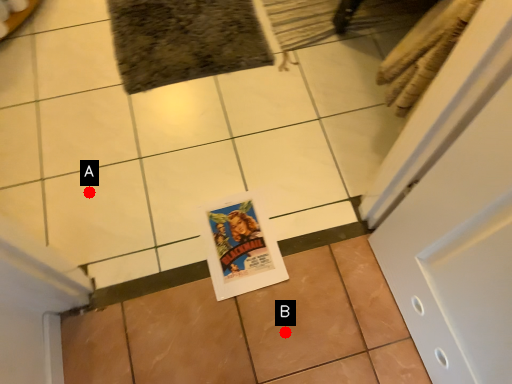
Question: Two points are circled on the image, labeled by A and B beside each circle. Which point appears farthest from the camera in this image?

Choices:
 (A) A is further
 (B) B is further

Answer: (A)